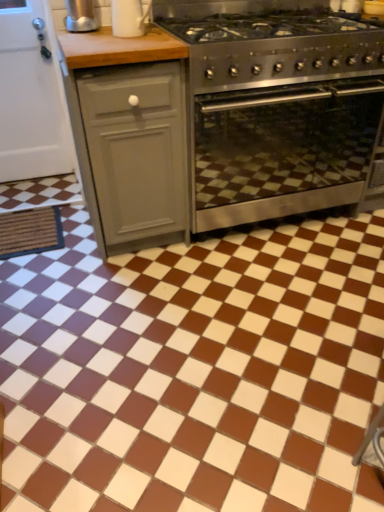
In order to click on vacant area that is in front of satin silver kettle at upper left in this screenshot , I will do `click(87, 33)`.